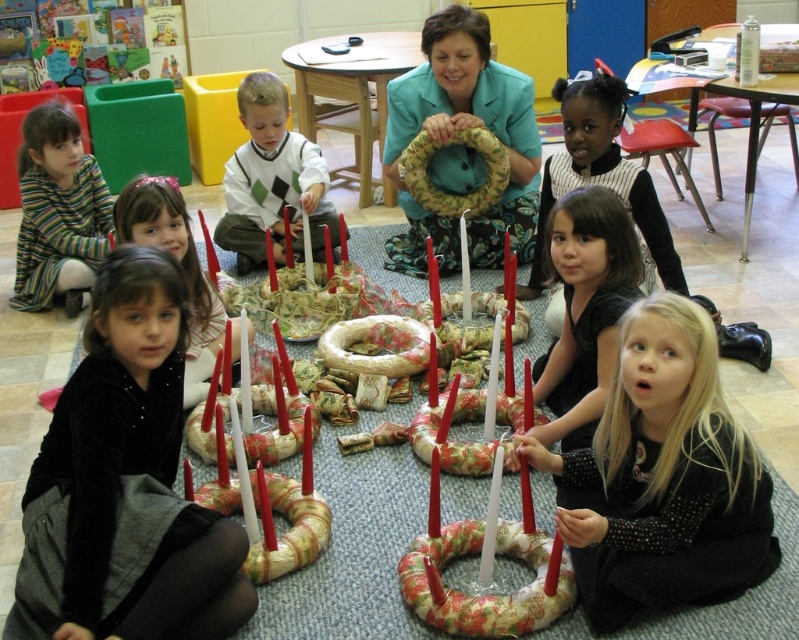
You are a student in the classroom and want to move from your current position to the adult standing behind the wreaths. There are two points marked in the scene. The first point is at coordinate point(138,556) and the second point is at coordinate point(603,305). Which point should you walk towards to reach the adult more quickly?

Point(138,556) is in front of point(603,305), so walking towards point(138,556) would be closer to the adult and thus faster.

You are standing in the classroom and want to place a small decoration between the point at coordinates point (251, 122) and point (129, 195). Which point is closer to you so you can place the decoration there?

Point (251, 122) is further to the viewer than point (129, 195), so the decoration should be placed closer to point (129, 195) since it is nearer to you.

You are a photographer standing behind the adult in the scene. You want to take a photo that includes both the velvet black dress at lower left and the floral fabric wreath at center. Which object should you adjust your camera angle to ensure both are in frame?

The velvet black dress at lower left is positioned on the left side of floral fabric wreath at center. To include both in the frame, adjust your camera angle to the left to capture the velvet black dress at lower left and the floral fabric wreath at center.